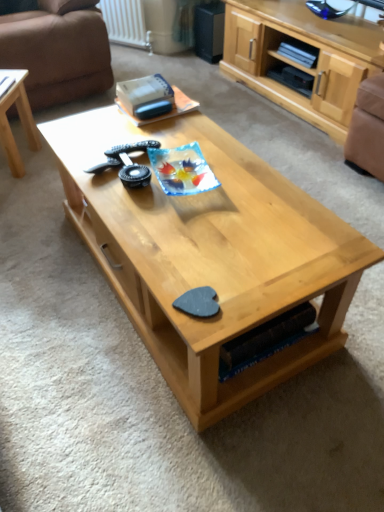
Question: In the image, is brown fabric armchair at right on the left side or the right side of natural wood coffee table at center, the 1th coffee table viewed from the right?

Choices:
 (A) right
 (B) left

Answer: (A)

Question: From a real-world perspective, is brown fabric armchair at right physically located above or below natural wood coffee table at center, the 1th coffee table viewed from the right?

Choices:
 (A) below
 (B) above

Answer: (B)

Question: Which object is positioned farthest from the brown fabric armchair at right?

Choices:
 (A) natural wood coffee table at center, the 1th coffee table viewed from the right
 (B) white textured radiator at upper center
 (C) light wood/texture coffee table at left, which is the second coffee table from right to left
 (D) brown leather couch at upper left
 (E) light wood cabinet at upper right

Answer: (B)

Question: Which object is the farthest from the white textured radiator at upper center?

Choices:
 (A) natural wood coffee table at center, the 1th coffee table viewed from the right
 (B) light wood/texture coffee table at left, which is the 1th coffee table in left-to-right order
 (C) light wood cabinet at upper right
 (D) brown leather couch at upper left
 (E) brown fabric armchair at right

Answer: (A)